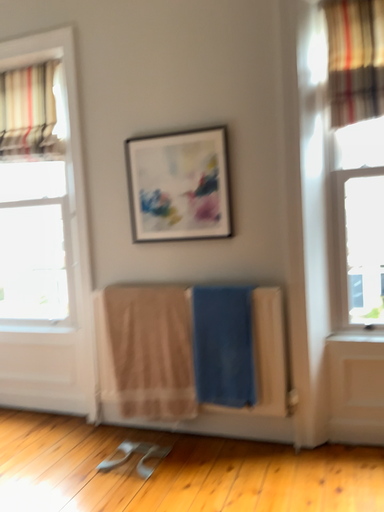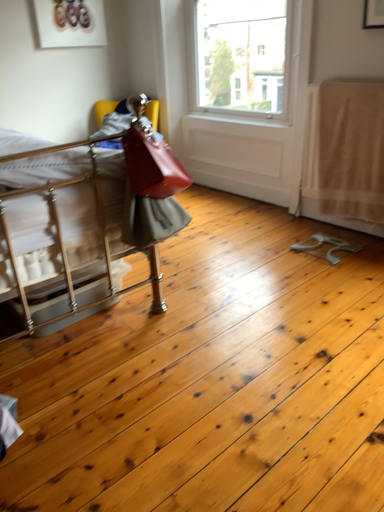
Question: Which way did the camera rotate in the video?

Choices:
 (A) rotated right
 (B) rotated left

Answer: (B)